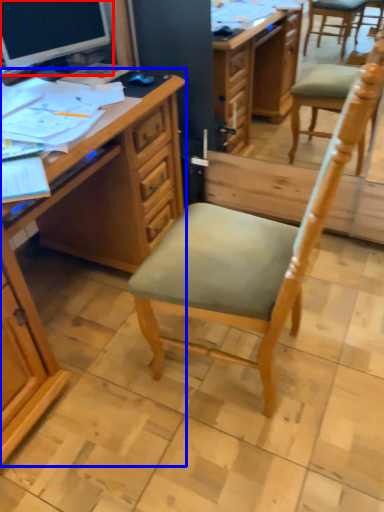
Question: Which point is further to the camera, computer monitor (highlighted by a red box) or desk (highlighted by a blue box)?

Choices:
 (A) computer monitor
 (B) desk

Answer: (A)